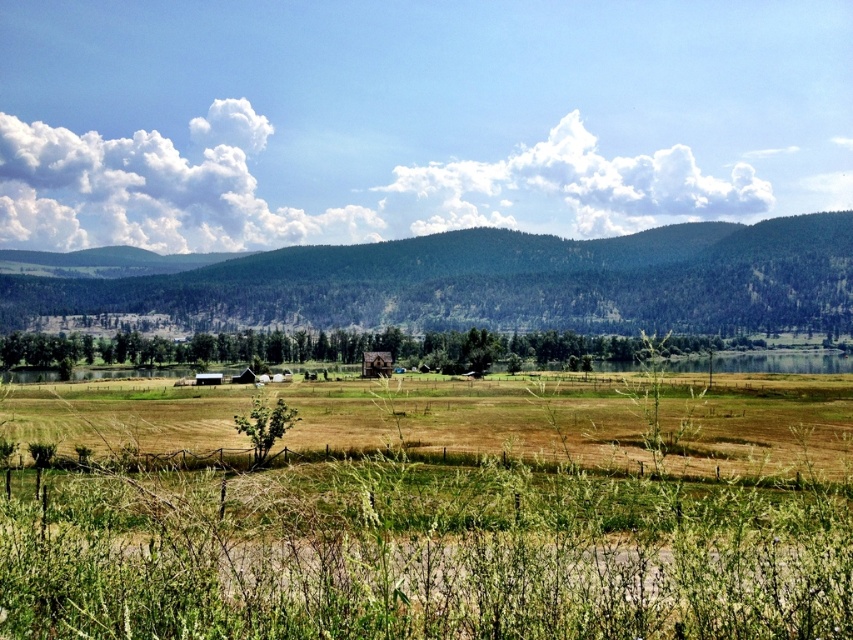
Consider the image. Who is positioned more to the right, green grass at center or brown wooden hut at center?

green grass at center is more to the right.

Does green grass at center have a lesser width compared to brown wooden hut at center?

In fact, green grass at center might be wider than brown wooden hut at center.

Find the location of a particular element. This screenshot has width=853, height=640. green grass at center is located at coordinates (425, 556).

Is point (42, 592) more distant than point (845, 314)?

No.

Based on the photo, which is more to the left, green grass at center or green forested mountain at center?

green grass at center

Find the location of a particular element. green grass at center is located at coordinates (425, 556).

This screenshot has width=853, height=640. I want to click on green grass at center, so click(x=425, y=556).

Between point (780, 260) and point (383, 365), which one is positioned behind?

Positioned behind is point (780, 260).

Is the position of green forested mountain at center less distant than that of brown wooden hut at center?

No.

Does point (619, 257) come farther from viewer compared to point (389, 353)?

Yes, point (619, 257) is farther from viewer.

Where is `green forested mountain at center`? green forested mountain at center is located at coordinates (497, 282).